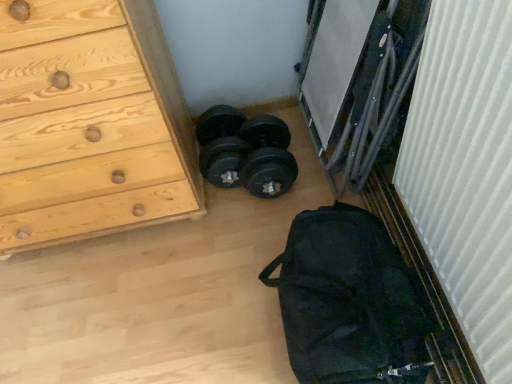
Where is `empty space that is in between black rubber dumbbells at center and black fabric bag at lower right`? This screenshot has height=384, width=512. empty space that is in between black rubber dumbbells at center and black fabric bag at lower right is located at coordinates (286, 207).